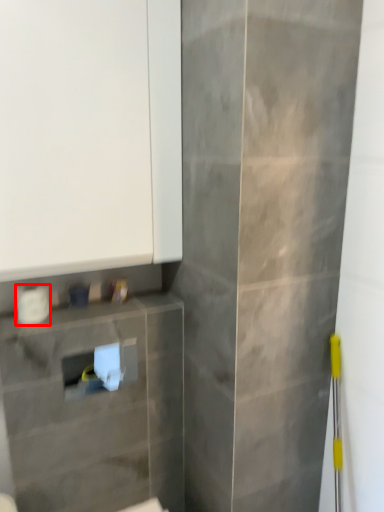
Question: From the image's perspective, what is the correct spatial positioning of toilet paper (annotated by the red box) in reference to cabinetry?

Choices:
 (A) below
 (B) above

Answer: (A)